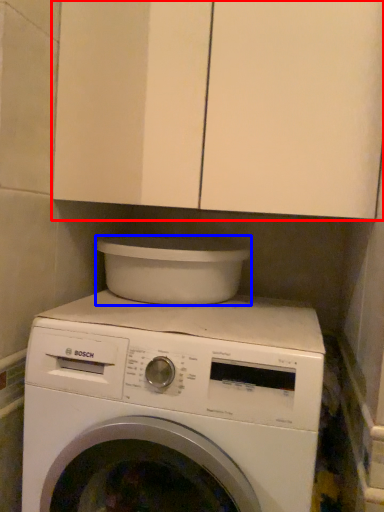
Question: Among these objects, which one is nearest to the camera, cabinetry (highlighted by a red box) or appliance (highlighted by a blue box)?

Choices:
 (A) cabinetry
 (B) appliance

Answer: (A)